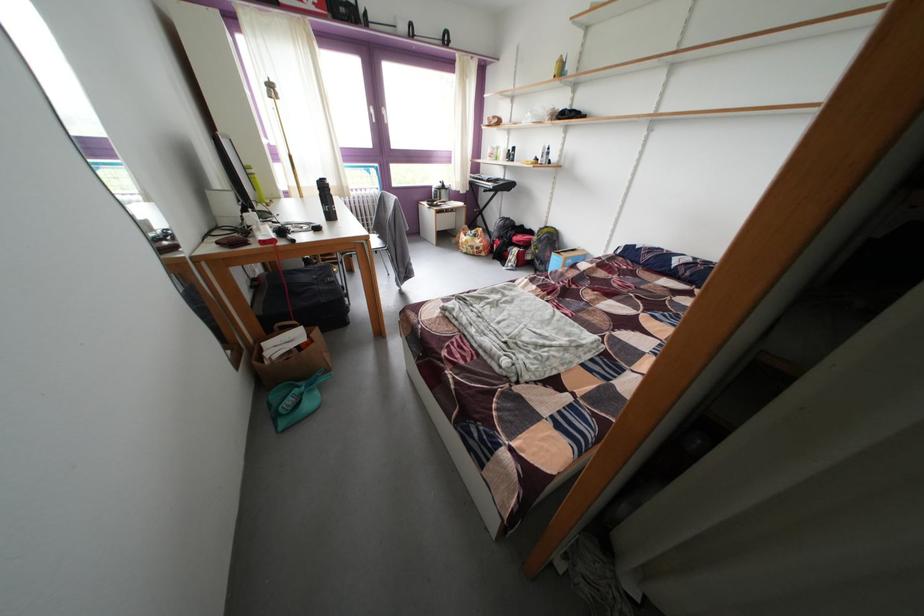
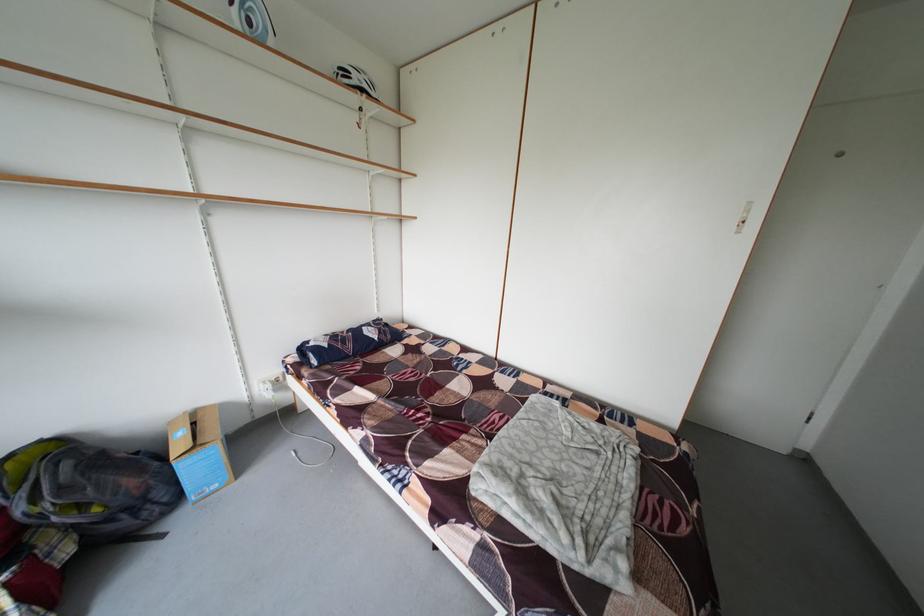
Locate, in the second image, the point that corresponds to the point at 659,262 in the first image.

(360, 351)